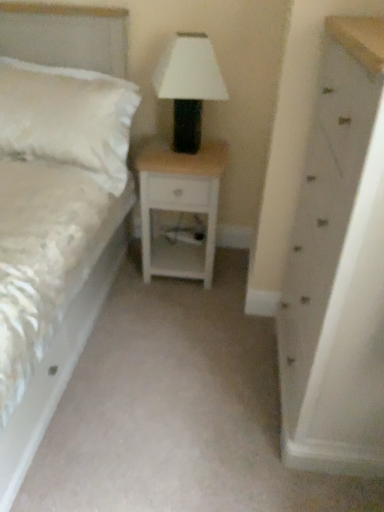
Question: Does white fluffy pillow at left turn towards white satin bed at left?

Choices:
 (A) yes
 (B) no

Answer: (A)

Question: Is white fluffy pillow at left behind white satin bed at left?

Choices:
 (A) no
 (B) yes

Answer: (B)

Question: Is white fluffy pillow at left oriented away from white satin bed at left?

Choices:
 (A) yes
 (B) no

Answer: (A)

Question: Considering the relative sizes of white fluffy pillow at left and white satin bed at left in the image provided, is white fluffy pillow at left taller than white satin bed at left?

Choices:
 (A) yes
 (B) no

Answer: (B)

Question: From a real-world perspective, is white fluffy pillow at left under white satin bed at left?

Choices:
 (A) yes
 (B) no

Answer: (B)

Question: In terms of width, does white painted wood chest of drawers at right look wider or thinner when compared to white fluffy pillow at left?

Choices:
 (A) wide
 (B) thin

Answer: (A)

Question: From a real-world perspective, is white painted wood chest of drawers at right physically located above or below white fluffy pillow at left?

Choices:
 (A) above
 (B) below

Answer: (B)

Question: In the image, is white painted wood chest of drawers at right positioned in front of or behind white fluffy pillow at left?

Choices:
 (A) front
 (B) behind

Answer: (A)

Question: Does point (307, 239) appear closer or farther from the camera than point (89, 86)?

Choices:
 (A) farther
 (B) closer

Answer: (B)

Question: From the image's perspective, is white wood nightstand at center above or below white matte/black textured table lamp at center?

Choices:
 (A) above
 (B) below

Answer: (B)

Question: Looking at their shapes, would you say white wood nightstand at center is wider or thinner than white matte/black textured table lamp at center?

Choices:
 (A) wide
 (B) thin

Answer: (A)

Question: Is white wood nightstand at center taller or shorter than white matte/black textured table lamp at center?

Choices:
 (A) tall
 (B) short

Answer: (A)

Question: Is point (213, 245) closer or farther from the camera than point (180, 86)?

Choices:
 (A) closer
 (B) farther

Answer: (B)

Question: Is white wood nightstand at center in front of or behind white painted wood chest of drawers at right in the image?

Choices:
 (A) behind
 (B) front

Answer: (A)

Question: Visually, is white wood nightstand at center positioned to the left or to the right of white painted wood chest of drawers at right?

Choices:
 (A) right
 (B) left

Answer: (B)